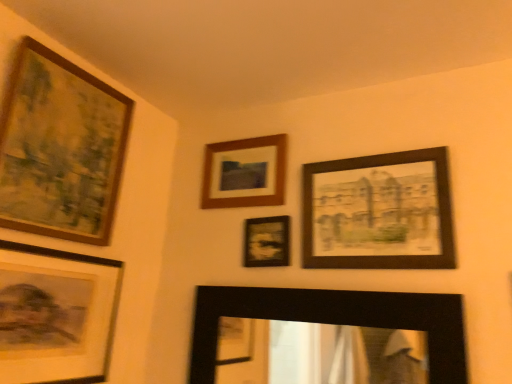
Question: From the image's perspective, is black matte mirror at lower center, which appears as the 5th picture frame when viewed from the left, located above matte black picture frame at center, positioned as the fourth picture frame in left-to-right order?

Choices:
 (A) yes
 (B) no

Answer: (B)

Question: Is black matte mirror at lower center, the 2th picture frame when ordered from right to left, not within matte black picture frame at center, placed as the third picture frame when sorted from right to left?

Choices:
 (A) no
 (B) yes

Answer: (B)

Question: Is matte black picture frame at center, placed as the third picture frame when sorted from right to left, at the back of black matte mirror at lower center, which appears as the 5th picture frame when viewed from the left?

Choices:
 (A) yes
 (B) no

Answer: (B)

Question: Is black matte mirror at lower center, the 2th picture frame when ordered from right to left, not close to matte black picture frame at center, positioned as the fourth picture frame in left-to-right order?

Choices:
 (A) yes
 (B) no

Answer: (B)

Question: Can you confirm if black matte mirror at lower center, which appears as the 5th picture frame when viewed from the left, is positioned to the right of matte black picture frame at center, positioned as the fourth picture frame in left-to-right order?

Choices:
 (A) yes
 (B) no

Answer: (A)

Question: Considering the relative positions of wooden-framed painting at upper left, arranged as the 1th picture frame when viewed from the left, and matte black picture frame at center, placed as the third picture frame when sorted from right to left, in the image provided, is wooden-framed painting at upper left, arranged as the 1th picture frame when viewed from the left, to the left or to the right of matte black picture frame at center, placed as the third picture frame when sorted from right to left,?

Choices:
 (A) right
 (B) left

Answer: (B)

Question: From the image's perspective, is wooden-framed painting at upper left, the 6th picture frame from the right, positioned above or below matte black picture frame at center, positioned as the fourth picture frame in left-to-right order?

Choices:
 (A) above
 (B) below

Answer: (A)

Question: Does point (108, 190) appear closer or farther from the camera than point (287, 241)?

Choices:
 (A) farther
 (B) closer

Answer: (A)

Question: From their relative heights in the image, would you say wooden-framed painting at upper left, arranged as the 1th picture frame when viewed from the left, is taller or shorter than matte black picture frame at center, positioned as the fourth picture frame in left-to-right order?

Choices:
 (A) tall
 (B) short

Answer: (A)

Question: Considering their positions, is matte black picture frame at center, positioned as the fourth picture frame in left-to-right order, located in front of or behind wooden framed print at upper right, which appears as the sixth picture frame when viewed from the left?

Choices:
 (A) front
 (B) behind

Answer: (B)

Question: Is matte black picture frame at center, placed as the third picture frame when sorted from right to left, wider or thinner than wooden framed print at upper right, which appears as the sixth picture frame when viewed from the left?

Choices:
 (A) wide
 (B) thin

Answer: (B)

Question: Considering the positions of matte black picture frame at center, positioned as the fourth picture frame in left-to-right order, and wooden framed print at upper right, arranged as the 1th picture frame when viewed from the right, in the image, is matte black picture frame at center, positioned as the fourth picture frame in left-to-right order, bigger or smaller than wooden framed print at upper right, arranged as the 1th picture frame when viewed from the right,?

Choices:
 (A) big
 (B) small

Answer: (B)

Question: Do you think matte black picture frame at center, placed as the third picture frame when sorted from right to left, is within wooden framed print at upper right, arranged as the 1th picture frame when viewed from the right, or outside of it?

Choices:
 (A) outside
 (B) inside

Answer: (A)

Question: From the image's perspective, relative to matte black picture frame at center, positioned as the fourth picture frame in left-to-right order, is wooden frame at upper center, which is the 4th picture frame in right-to-left order, above or below?

Choices:
 (A) above
 (B) below

Answer: (A)

Question: Based on their positions, is wooden frame at upper center, which is the 3th picture frame in left-to-right order, located to the left or right of matte black picture frame at center, placed as the third picture frame when sorted from right to left?

Choices:
 (A) left
 (B) right

Answer: (A)